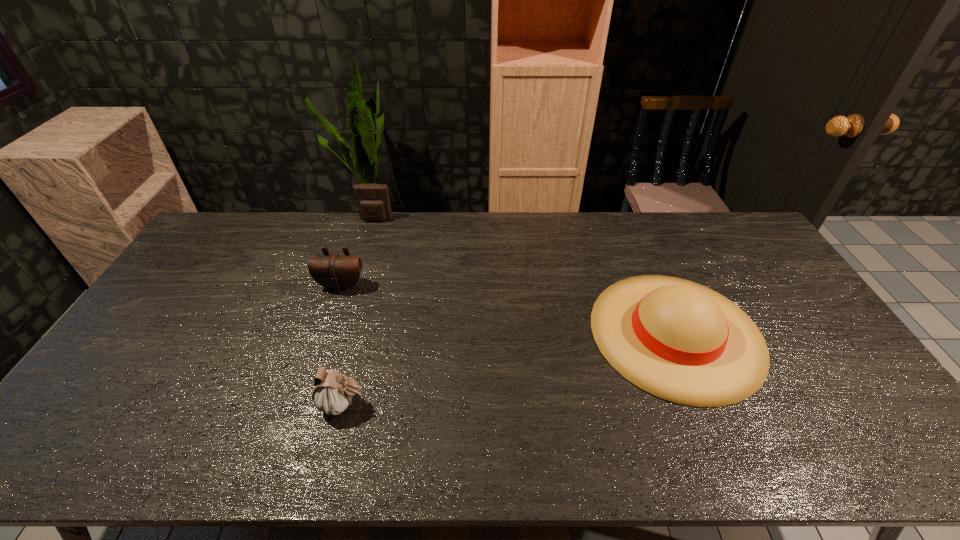
Find the location of `vacant area at the near edge`. vacant area at the near edge is located at coordinates (445, 463).

You are a GUI agent. You are given a task and a screenshot of the screen. Output one action in this format:
    pyautogui.click(x=<x>, y=<y>)
    Task: Click on the vacant space at the left edge
    
    Given the screenshot: What is the action you would take?
    pyautogui.click(x=132, y=395)

In the image, there is a desktop. Where is `free space at the right edge`? This screenshot has width=960, height=540. free space at the right edge is located at coordinates (801, 359).

Find the location of `vacant space at the far left corner`. vacant space at the far left corner is located at coordinates (244, 237).

This screenshot has width=960, height=540. In the image, there is a desktop. Find the location of `free space at the near left corner`. free space at the near left corner is located at coordinates (106, 449).

Find the location of `vacant space at the far right corner of the desktop`. vacant space at the far right corner of the desktop is located at coordinates (711, 227).

At what (x,y) coordinates should I click in order to perform the action: click on free space at the near right corner of the desktop. Please return your answer as a coordinate pair (x, y). This screenshot has height=540, width=960. Looking at the image, I should click on pyautogui.click(x=895, y=462).

Identify the location of free spot between the rightmost object and the farthest pouch. (526, 276).

The height and width of the screenshot is (540, 960). I want to click on unoccupied area between the second nearest pouch and the farthest pouch, so (358, 253).

Where is `free spot between the rightmost object and the nearest pouch`? This screenshot has width=960, height=540. free spot between the rightmost object and the nearest pouch is located at coordinates (510, 369).